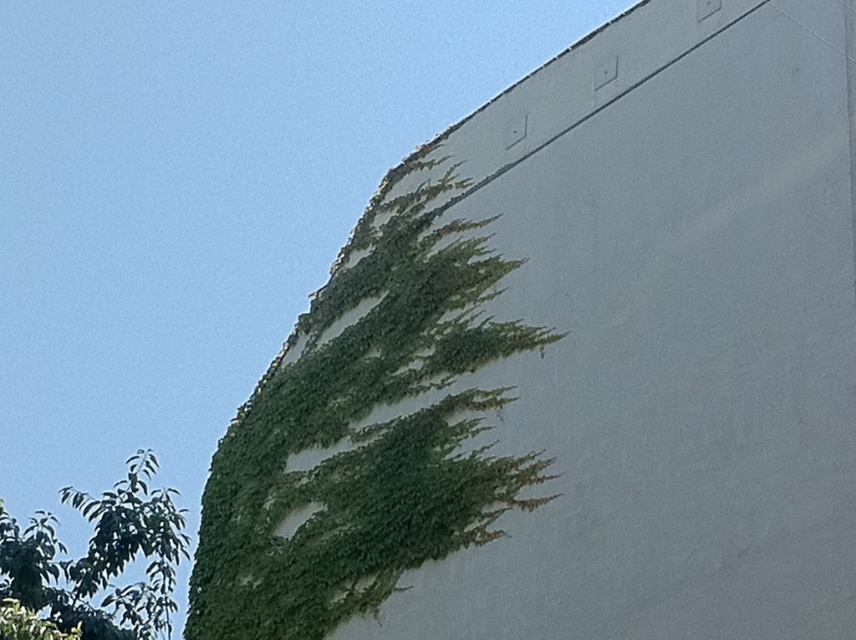
You are an artist planning to paint a mural on the white wall. You notice the green leafy ivy at upper left and the green leafy tree at lower left. Which of these two plants is higher up on the wall?

The green leafy ivy at upper left is taller than the green leafy tree at lower left, so the ivy is higher up on the wall.

You are an interior designer assessing a wall with two green plants. You need to determine which plant is closer to the top of the wall. The plants are the green leafy ivy at upper left and the green leafy tree at lower left. Which one is positioned higher?

The green leafy ivy at upper left is positioned higher on the wall than the green leafy tree at lower left.

You are standing in front of a white wall with some plants. You see the green leafy ivy at upper left and the green leafy tree at lower left. Which plant is positioned to the right of the other?

The green leafy ivy at upper left is to the right of the green leafy tree at lower left.